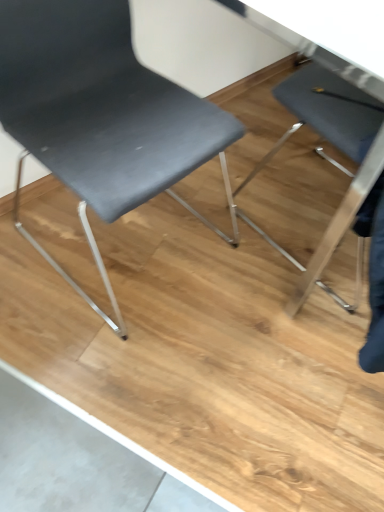
Where is `vacant area situated to the left side of matte black chair at right, marked as the 1th chair in a right-to-left arrangement`? The image size is (384, 512). vacant area situated to the left side of matte black chair at right, marked as the 1th chair in a right-to-left arrangement is located at coordinates (231, 227).